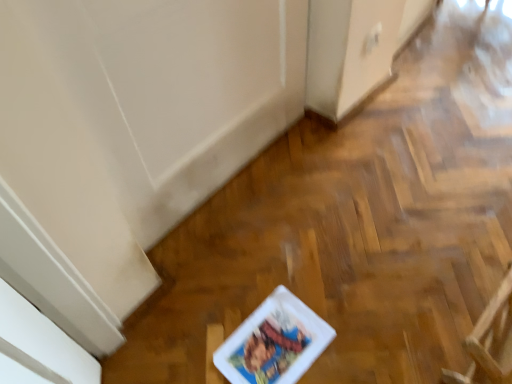
Where is `free space to the left of white glossy comic book at center`? This screenshot has width=512, height=384. free space to the left of white glossy comic book at center is located at coordinates (192, 327).